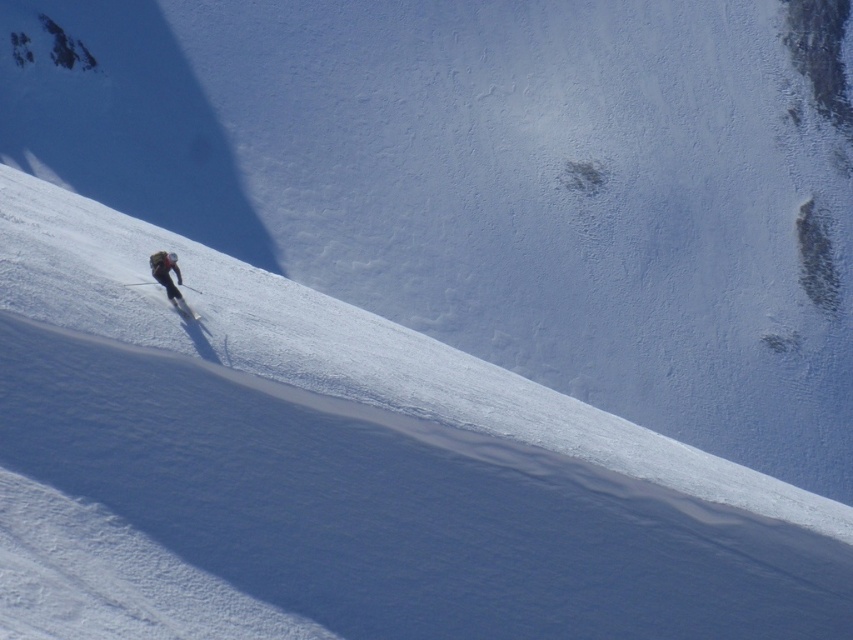
Question: Does white powder snow at center appear over matte black ski at lower left?

Choices:
 (A) no
 (B) yes

Answer: (A)

Question: Can you confirm if white powder snow at center is thinner than matte black snowboarder at lower left?

Choices:
 (A) no
 (B) yes

Answer: (A)

Question: Which point is closer to the camera?

Choices:
 (A) (67, 272)
 (B) (171, 291)
 (C) (196, 317)

Answer: (C)

Question: Is matte black snowboarder at lower left to the left of matte black ski at lower left from the viewer's perspective?

Choices:
 (A) yes
 (B) no

Answer: (B)

Question: Which point is farther from the camera taking this photo?

Choices:
 (A) (173, 298)
 (B) (494, 561)
 (C) (173, 298)

Answer: (C)

Question: Among these points, which one is farthest from the camera?

Choices:
 (A) (194, 317)
 (B) (178, 280)
 (C) (631, 557)

Answer: (B)